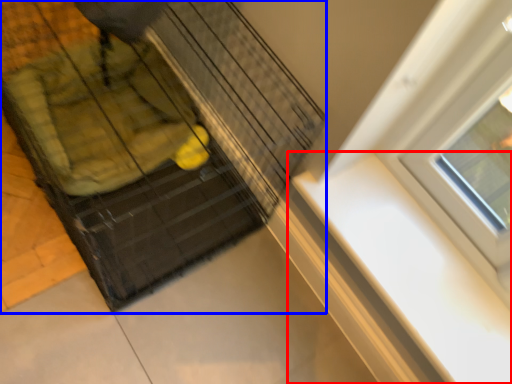
Question: Which point is closer to the camera, window sill (highlighted by a red box) or baby carriage (highlighted by a blue box)?

Choices:
 (A) window sill
 (B) baby carriage

Answer: (B)